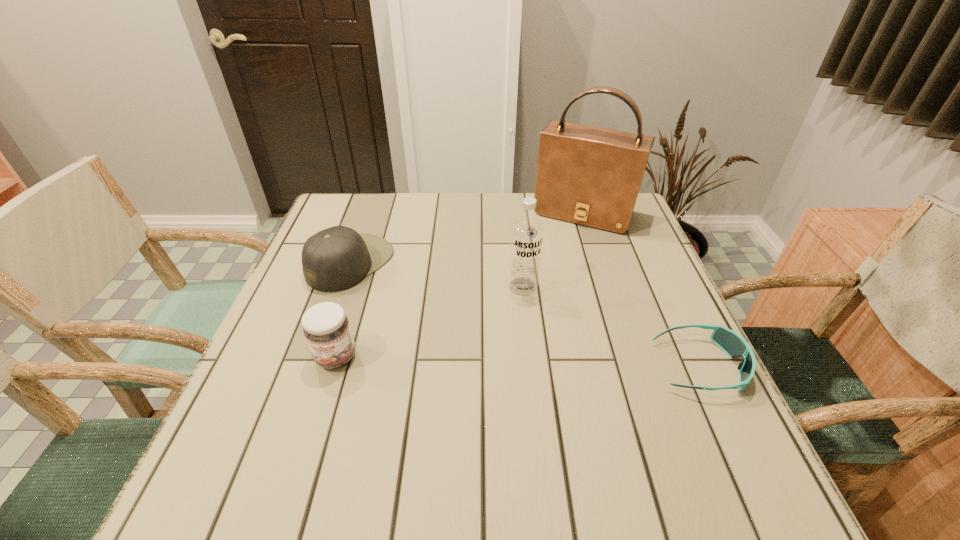
At what (x,y) coordinates should I click in order to perform the action: click on free location that satisfies the following two spatial constraints: 1. on the front label of the sunglasses; 2. on the front-facing side of the jam. Please return your answer as a coordinate pair (x, y). The image size is (960, 540). Looking at the image, I should click on (333, 366).

The image size is (960, 540). In order to click on free space that satisfies the following two spatial constraints: 1. on the front side of the sunglasses; 2. on the front-facing side of the cap in this screenshot , I will do `click(314, 366)`.